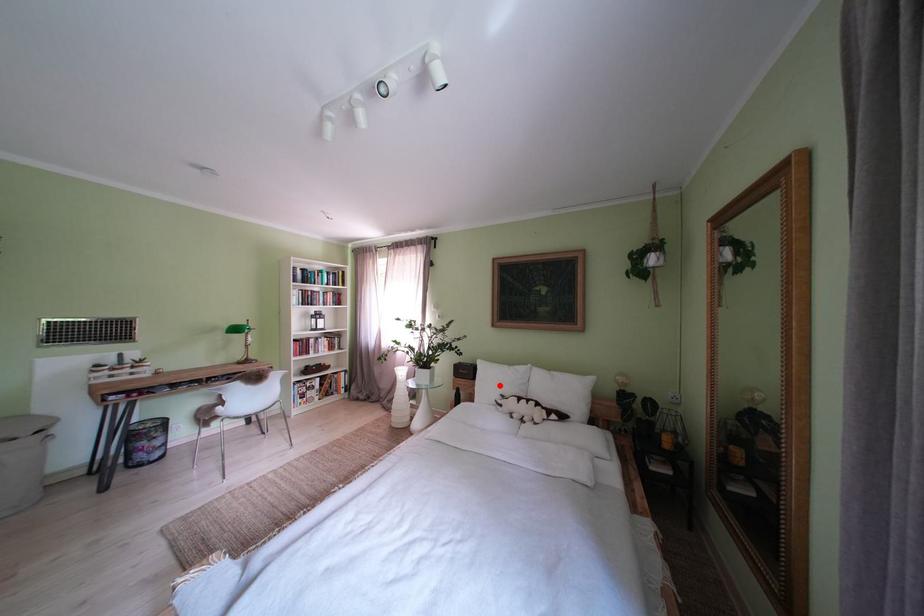
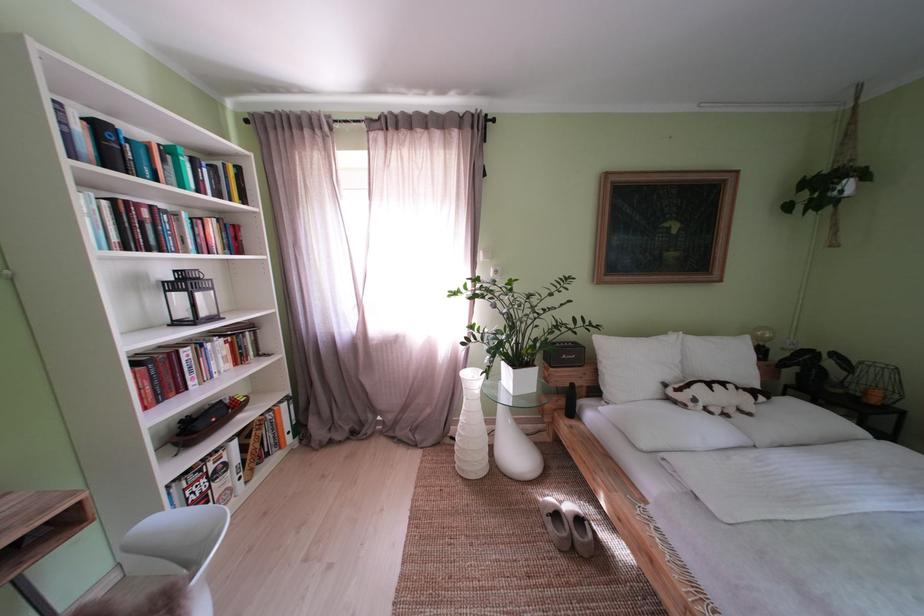
The point at the highlighted location is marked in the first image. Where is the corresponding point in the second image?

(639, 369)